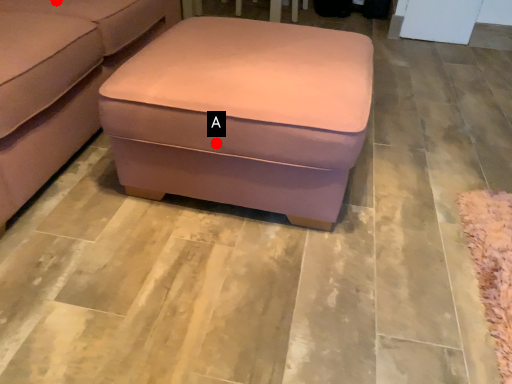
Question: Two points are circled on the image, labeled by A and B beside each circle. Which point is farther to the camera?

Choices:
 (A) A is further
 (B) B is further

Answer: (B)